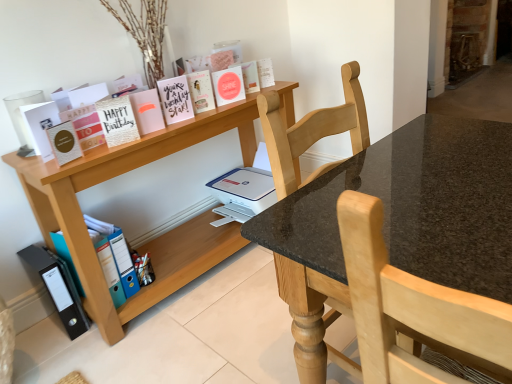
Locate an element on the screen. The width and height of the screenshot is (512, 384). spots to the right of pink matte card at upper center, marked as the sixth paperback book in a right-to-left arrangement is located at coordinates (181, 124).